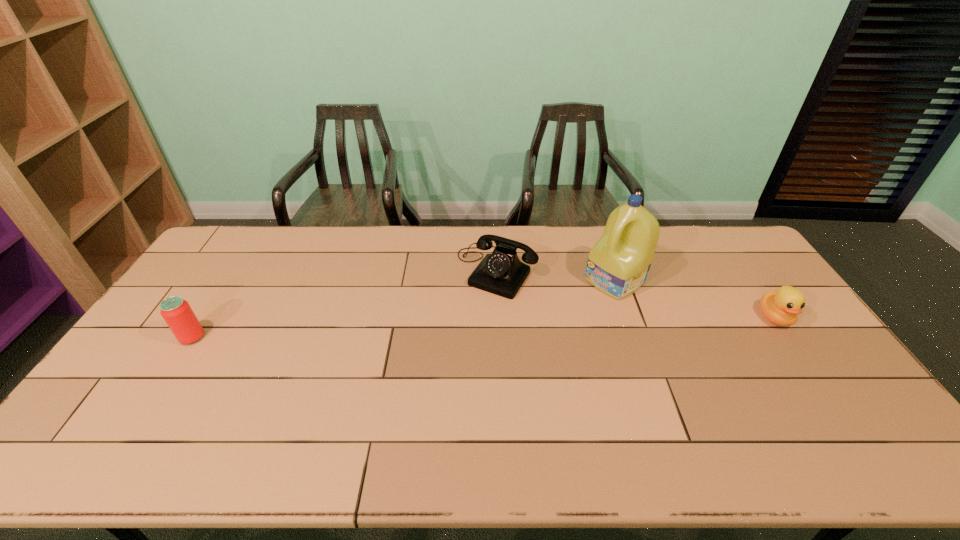
Find the location of a particular element. The width and height of the screenshot is (960, 540). vacant space at the right edge of the desktop is located at coordinates (769, 284).

What are the coordinates of `blank area at the far left corner` in the screenshot? It's located at (218, 248).

Identify the location of vacant area between the second object from right to left and the rightmost object. The height and width of the screenshot is (540, 960). (694, 299).

What are the coordinates of `empty space between the detergent and the third object from right to left` in the screenshot? It's located at (556, 276).

You are a GUI agent. You are given a task and a screenshot of the screen. Output one action in this format:
    pyautogui.click(x=<x>, y=<y>)
    Task: Click on the vacant space in between the telephone and the leftmost object
    
    Given the screenshot: What is the action you would take?
    pyautogui.click(x=345, y=305)

Identify the location of empty space between the third object from left to right and the duckling. (694, 299).

Find the location of a particular element. free space that is in between the tallest object and the rightmost object is located at coordinates (694, 299).

Where is `free spot between the leftmost object and the rightmost object`? The width and height of the screenshot is (960, 540). free spot between the leftmost object and the rightmost object is located at coordinates (484, 327).

The width and height of the screenshot is (960, 540). In order to click on empty location between the rightmost object and the beer can in this screenshot , I will do `click(484, 327)`.

Locate an element on the screen. The width and height of the screenshot is (960, 540). vacant point located between the beer can and the duckling is located at coordinates (484, 327).